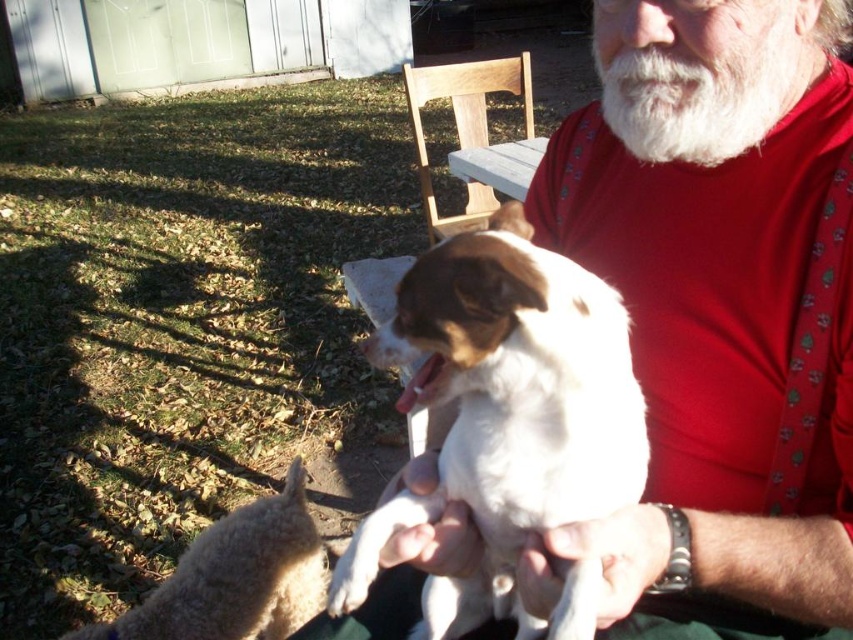
Question: Which of the following is the farthest from the observer?

Choices:
 (A) (694, 68)
 (B) (281, 616)
 (C) (767, 289)
 (D) (509, 556)

Answer: (B)

Question: Can you confirm if fuzzy beige alpaca at lower left is positioned above white fluffy beard at upper center?

Choices:
 (A) no
 (B) yes

Answer: (A)

Question: Which object is the closest to the smooth red shirt at center?

Choices:
 (A) fuzzy beige alpaca at lower left
 (B) white fluffy dog at center
 (C) white fluffy beard at upper center

Answer: (B)

Question: Among these points, which one is nearest to the camera?

Choices:
 (A) (749, 65)
 (B) (635, 420)
 (C) (265, 536)
 (D) (666, 1)

Answer: (B)

Question: Is white fluffy dog at center below fuzzy beige alpaca at lower left?

Choices:
 (A) no
 (B) yes

Answer: (A)

Question: Is smooth red shirt at center to the left of white fluffy beard at upper center from the viewer's perspective?

Choices:
 (A) yes
 (B) no

Answer: (A)